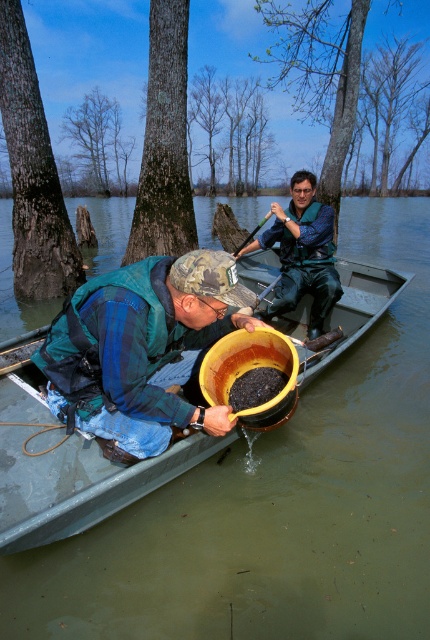
Question: Which object appears farthest from the camera in this image?

Choices:
 (A) camouflage fabric hat at center
 (B) green plastic boat at center

Answer: (A)

Question: Is camouflage fabric hat at center bigger than blue fabric jacket at center?

Choices:
 (A) no
 (B) yes

Answer: (B)

Question: Is green plastic boat at center above blue fabric jacket at center?

Choices:
 (A) yes
 (B) no

Answer: (B)

Question: Is camouflage fabric hat at center above wooden paddle at center?

Choices:
 (A) yes
 (B) no

Answer: (B)

Question: Which point is farther to the camera?

Choices:
 (A) (322, 282)
 (B) (350, 276)
 (C) (260, 221)

Answer: (C)

Question: Which point is farther to the camera?

Choices:
 (A) blue fabric jacket at center
 (B) green plastic boat at center
 (C) wooden paddle at center

Answer: (C)